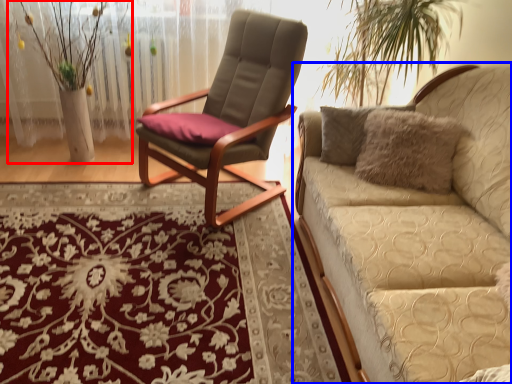
Question: Which object appears farthest to the camera in this image, floral arrangement (highlighted by a red box) or studio couch (highlighted by a blue box)?

Choices:
 (A) floral arrangement
 (B) studio couch

Answer: (A)